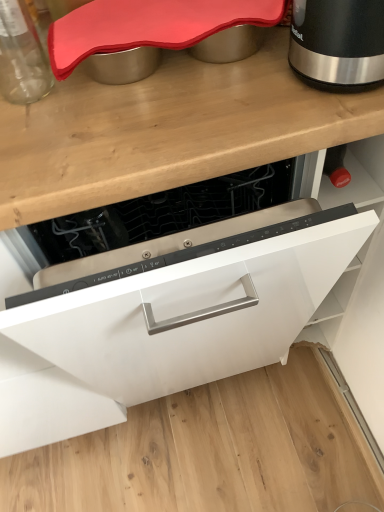
Question: From their relative heights in the image, would you say white matte cabinet at center is taller or shorter than black metallic kettle at upper right?

Choices:
 (A) short
 (B) tall

Answer: (B)

Question: Is white matte cabinet at center wider or thinner than black metallic kettle at upper right?

Choices:
 (A) thin
 (B) wide

Answer: (B)

Question: Which object is positioned farthest from the transparent glass jar at upper left?

Choices:
 (A) black metallic kettle at upper right
 (B) white matte cabinet at center

Answer: (B)

Question: Which is farther from the transparent glass jar at upper left?

Choices:
 (A) white matte cabinet at center
 (B) black metallic kettle at upper right

Answer: (A)